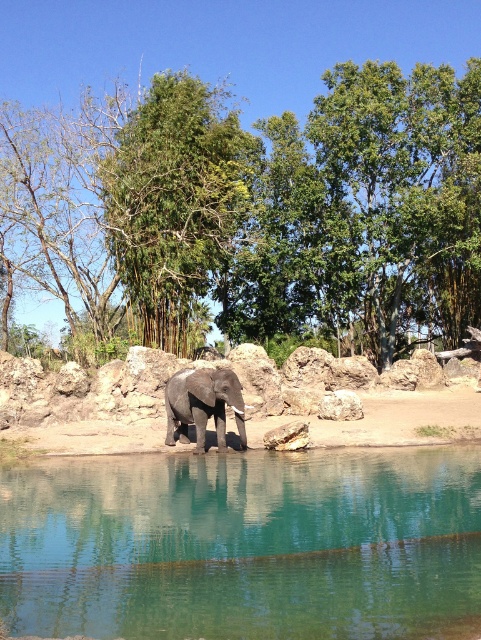
Question: Which object is positioned farthest from the green leafy tree at center?

Choices:
 (A) gray matte elephant at center
 (B) green leafy tree at upper center

Answer: (A)

Question: Where is green leafy tree at upper center located in relation to gray matte elephant at center in the image?

Choices:
 (A) left
 (B) right

Answer: (A)

Question: Which point is closer to the camera?

Choices:
 (A) (66, 582)
 (B) (197, 412)
 (C) (141, 148)
 (D) (414, 209)

Answer: (A)

Question: Is green leafy tree at center to the left of gray matte elephant at center from the viewer's perspective?

Choices:
 (A) no
 (B) yes

Answer: (A)

Question: Does green leafy tree at center appear under gray matte elephant at center?

Choices:
 (A) yes
 (B) no

Answer: (B)

Question: Which of the following is the closest to the observer?

Choices:
 (A) clear glass water at center
 (B) green leafy tree at center
 (C) gray matte elephant at center

Answer: (A)